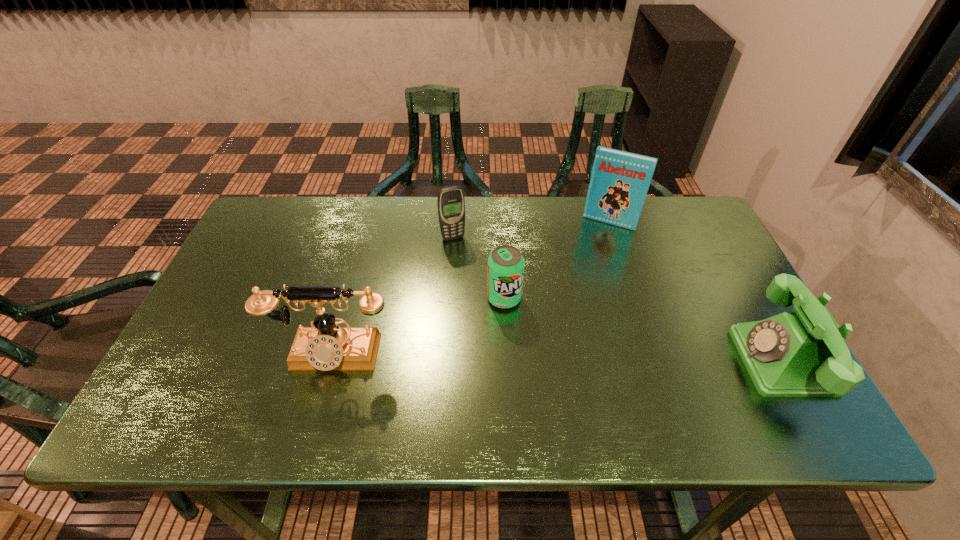
Image resolution: width=960 pixels, height=540 pixels. What are the coordinates of `vacant area situated on the front-facing side of the pop soda` in the screenshot? It's located at (550, 359).

Locate an element on the screen. Image resolution: width=960 pixels, height=540 pixels. free space located on the front-facing side of the pop soda is located at coordinates (574, 390).

Identify the location of cellular telephone at the far edge. The height and width of the screenshot is (540, 960). (451, 204).

The image size is (960, 540). Find the location of `book that is at the far edge`. book that is at the far edge is located at coordinates (620, 180).

Where is `object positioned at the right edge`? object positioned at the right edge is located at coordinates (793, 354).

Find the location of a particular element. The image size is (960, 540). object at the near right corner is located at coordinates (793, 354).

The image size is (960, 540). Find the location of `vacant point at the far edge`. vacant point at the far edge is located at coordinates (575, 206).

The image size is (960, 540). In order to click on vacant region at the near edge of the desktop in this screenshot , I will do `click(421, 366)`.

I want to click on free space at the left edge of the desktop, so coord(207,325).

Where is `vacant region at the right edge of the desktop`? Image resolution: width=960 pixels, height=540 pixels. vacant region at the right edge of the desktop is located at coordinates (701, 253).